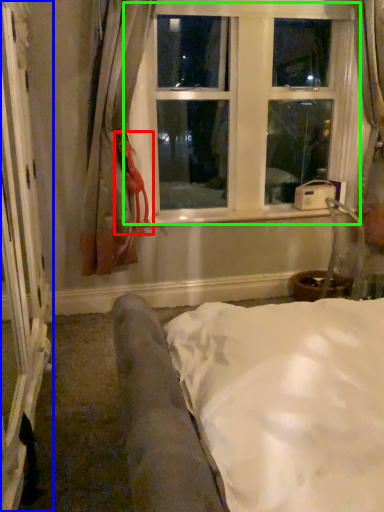
Question: Which object is the farthest from doll (highlighted by a red box)? Choose among these: screen door (highlighted by a blue box) or window (highlighted by a green box).

Choices:
 (A) screen door
 (B) window

Answer: (A)